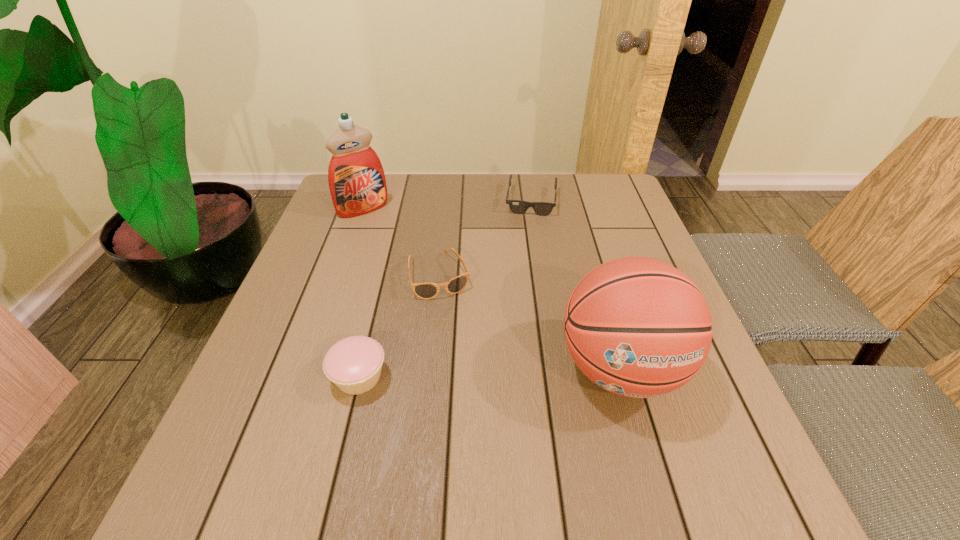
You are a GUI agent. You are given a task and a screenshot of the screen. Output one action in this format:
    pyautogui.click(x=<x>, y=<y>)
    Task: Click on the free space located on the front surface of the detergent
    
    Given the screenshot: What is the action you would take?
    pyautogui.click(x=418, y=267)

You are a GUI agent. You are given a task and a screenshot of the screen. Output one action in this format:
    pyautogui.click(x=<x>, y=<y>)
    Task: Click on the blank space located on the front surface of the detergent
    Image resolution: width=960 pixels, height=540 pixels.
    Given the screenshot: What is the action you would take?
    pyautogui.click(x=431, y=283)

This screenshot has height=540, width=960. Identify the location of vacant area situated on the front surface of the detergent. (384, 230).

The width and height of the screenshot is (960, 540). Find the location of `free space located on the front-facing side of the left sunglasses`. free space located on the front-facing side of the left sunglasses is located at coordinates (486, 411).

The image size is (960, 540). I want to click on vacant region located 0.320m on the front-facing side of the left sunglasses, so click(490, 421).

This screenshot has height=540, width=960. Find the location of `free spot located 0.080m on the front-facing side of the left sunglasses`. free spot located 0.080m on the front-facing side of the left sunglasses is located at coordinates (455, 323).

Where is `sunglasses that is positioned at the far edge`? sunglasses that is positioned at the far edge is located at coordinates (516, 206).

At what (x,y) coordinates should I click in order to perform the action: click on detergent present at the far edge. Please return your answer as a coordinate pair (x, y). Looking at the image, I should click on (356, 178).

Where is `object situated at the near edge`? The height and width of the screenshot is (540, 960). object situated at the near edge is located at coordinates (638, 327).

Where is `cupcake that is positioned at the left edge`? cupcake that is positioned at the left edge is located at coordinates click(x=353, y=364).